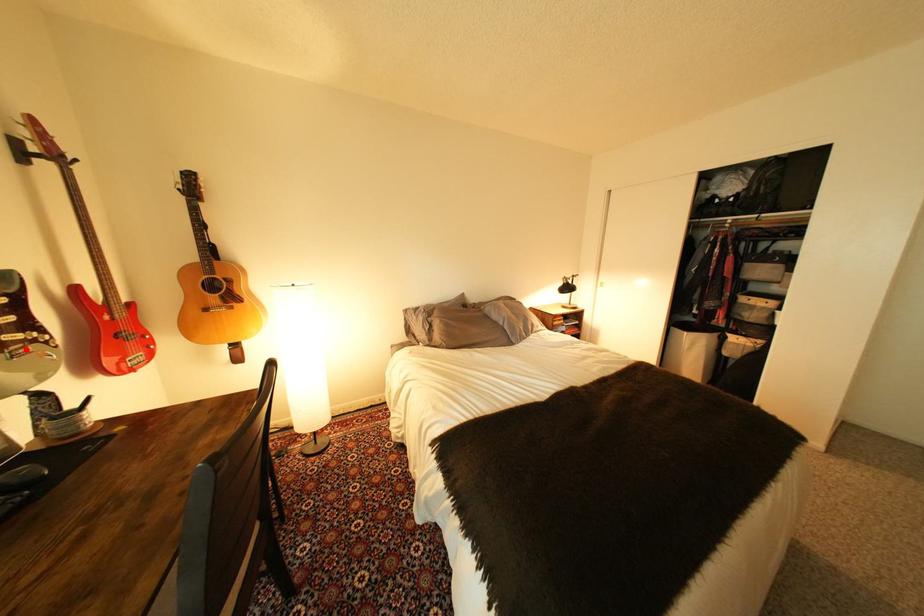
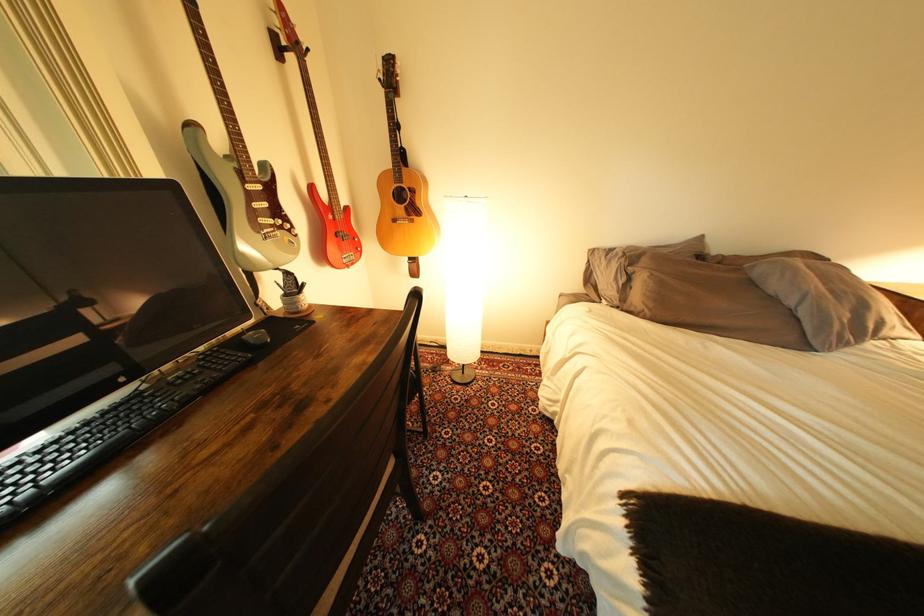
Find the pixel in the second image that matches the highlighted location in the first image.

(278, 233)